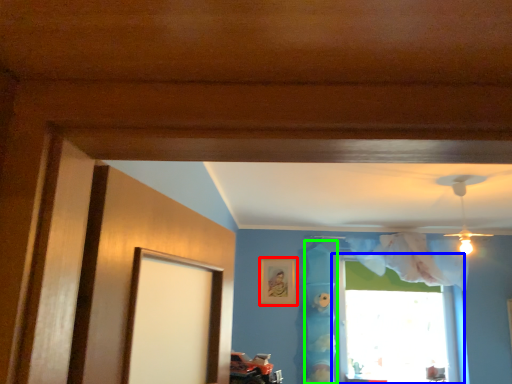
Question: Considering the real-world distances, which object is closest to picture frame (highlighted by a red box)? window (highlighted by a blue box) or curtain (highlighted by a green box).

Choices:
 (A) window
 (B) curtain

Answer: (B)